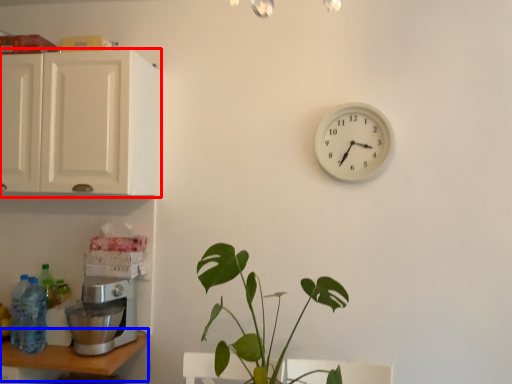
Question: Which of the following is the closest to the observer, cabinetry (highlighted by a red box) or table (highlighted by a blue box)?

Choices:
 (A) cabinetry
 (B) table

Answer: (B)